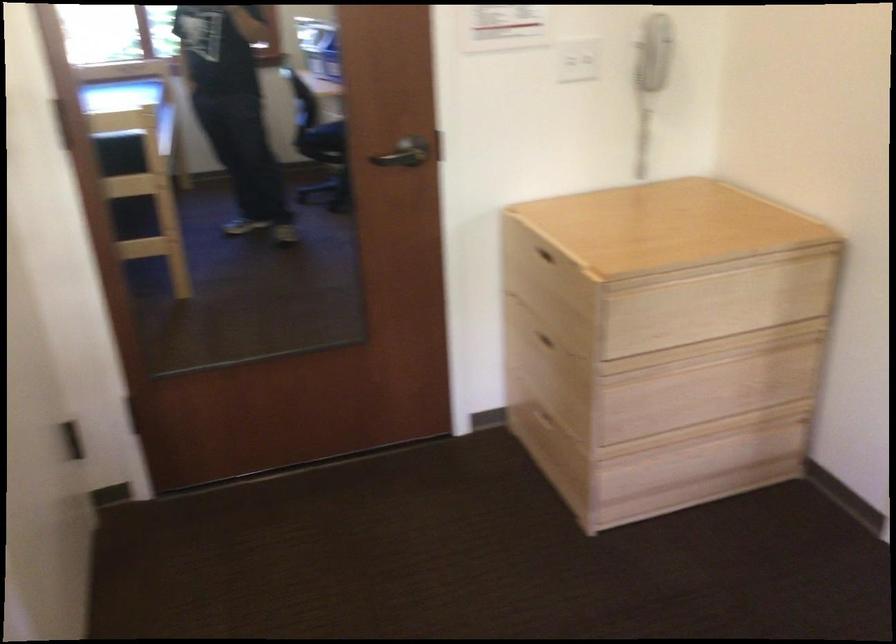
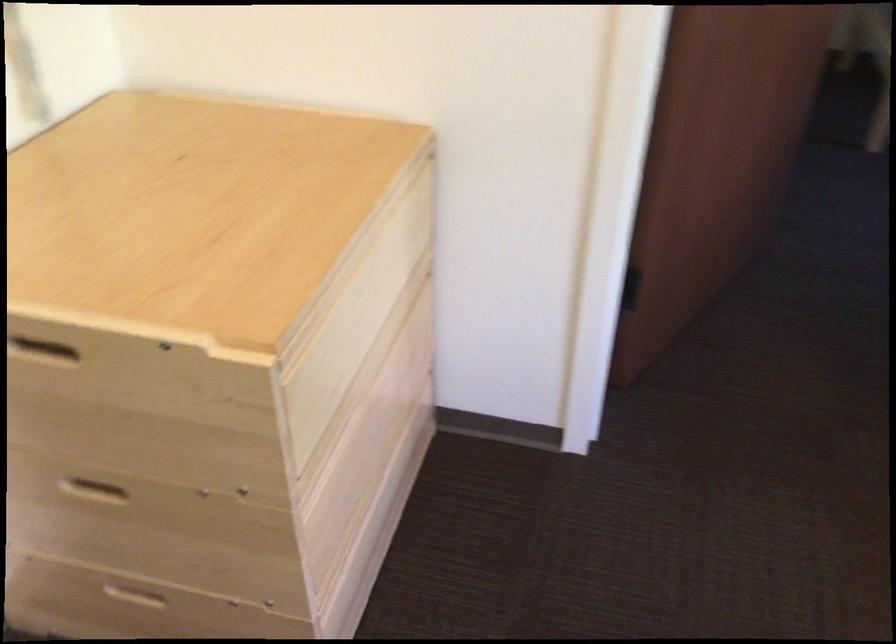
Locate, in the second image, the point that corresponds to the point at 540,424 in the first image.

(135, 600)